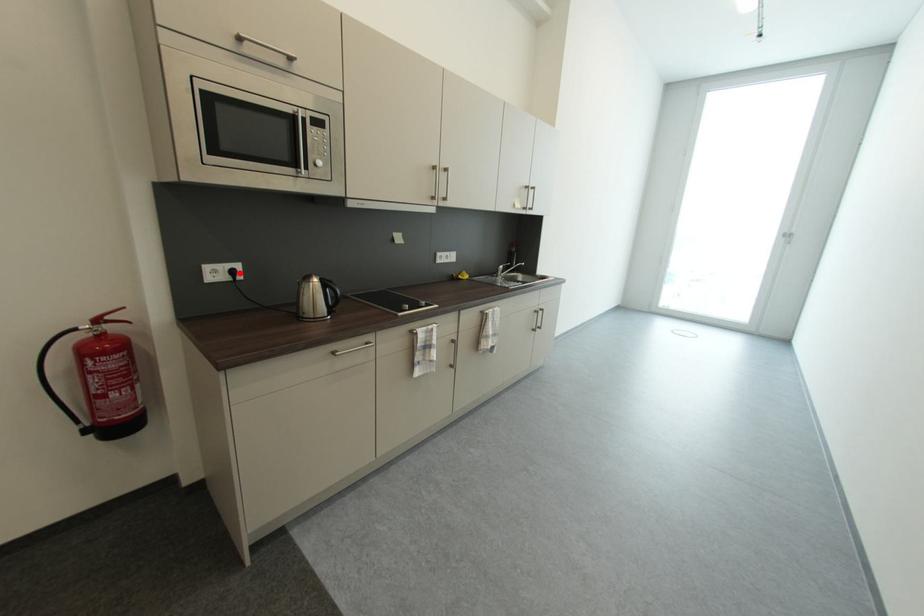
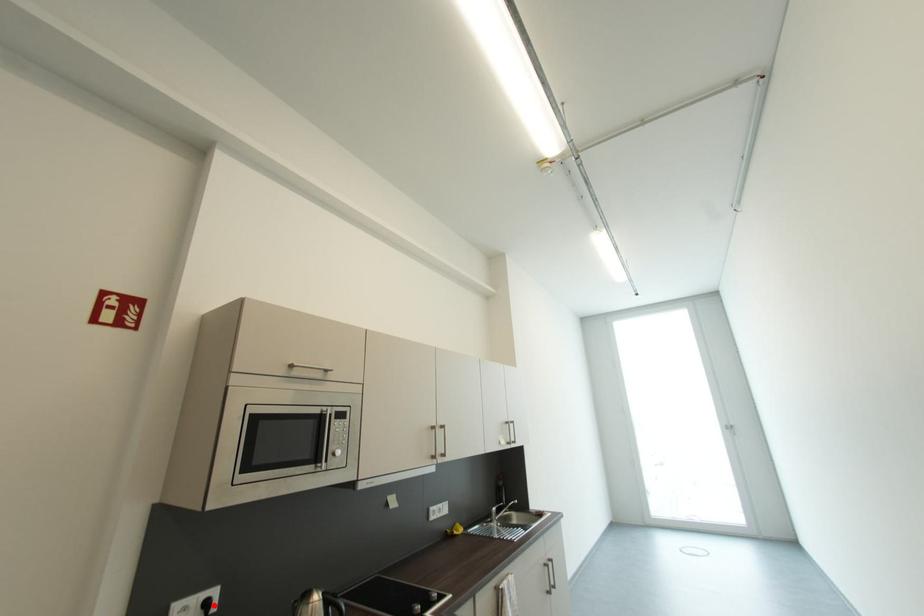
I am providing you with two images of the same scene from different viewpoints. A red point is marked on the first image and another point is marked on the second image. Do the highlighted points in image1 and image2 indicate the same real-world spot?

Yes